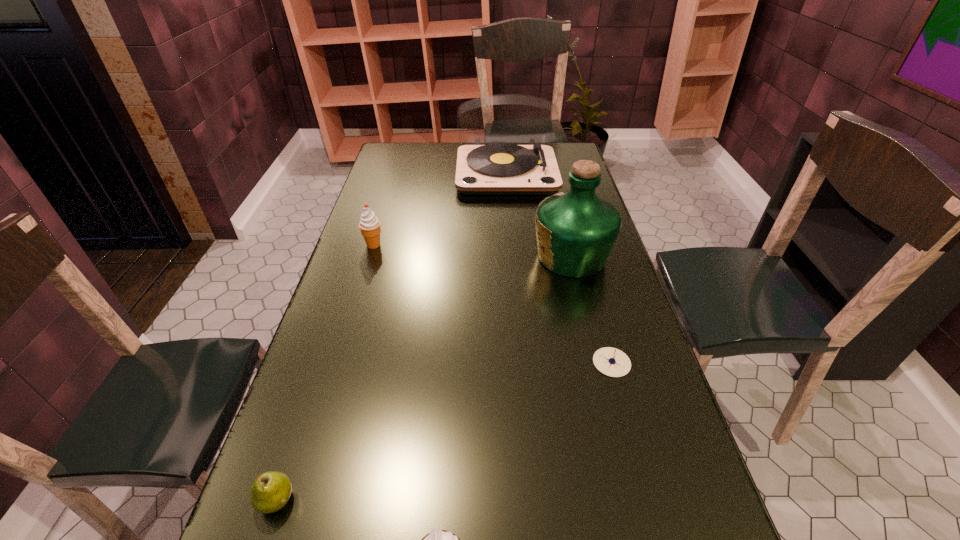
You are a GUI agent. You are given a task and a screenshot of the screen. Output one action in this format:
    pyautogui.click(x=<x>, y=<y>)
    Task: Click on the farthest object
    
    Given the screenshot: What is the action you would take?
    pyautogui.click(x=494, y=169)

Image resolution: width=960 pixels, height=540 pixels. What are the coordinates of `liquor` in the screenshot? It's located at (576, 230).

Locate an element on the screen. Image resolution: width=960 pixels, height=540 pixels. the left icecream is located at coordinates (369, 225).

Image resolution: width=960 pixels, height=540 pixels. What are the coordinates of `the fifth tallest object` in the screenshot? It's located at (270, 491).

The width and height of the screenshot is (960, 540). I want to click on pear, so click(x=270, y=491).

Where is `the fourth farthest object`? The height and width of the screenshot is (540, 960). the fourth farthest object is located at coordinates (612, 362).

Find the location of a particular element. The height and width of the screenshot is (540, 960). the shortest object is located at coordinates point(612,362).

Find the location of a particular element. This screenshot has height=540, width=960. vacant point located with the tonearm facing the front of the record player is located at coordinates (512, 226).

The image size is (960, 540). What are the coordinates of `vacant point located 0.330m on the label side of the liquor` in the screenshot? It's located at (422, 256).

Locate an element on the screen. free spot located 0.100m on the label side of the liquor is located at coordinates (498, 256).